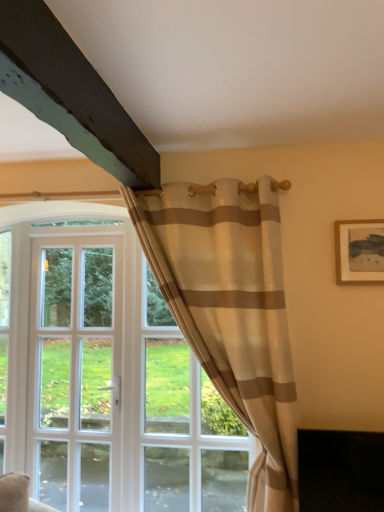
What is the approximate height of beige striped fabric at center?

The height of beige striped fabric at center is 5.71 feet.

You are a GUI agent. You are given a task and a screenshot of the screen. Output one action in this format:
    pyautogui.click(x=<x>, y=<y>)
    Task: Click on the beige striped fabric at center
    
    Given the screenshot: What is the action you would take?
    pyautogui.click(x=231, y=309)

At what (x,y) coordinates should I click in order to perform the action: click on beige striped fabric at center. Please return your answer as a coordinate pair (x, y). This screenshot has height=512, width=384. Looking at the image, I should click on (231, 309).

Is beige striped fabric at center in front of or behind wooden framed artwork at upper right in the image?

beige striped fabric at center is in front of wooden framed artwork at upper right.

Is beige striped fabric at center looking in the opposite direction of wooden framed artwork at upper right?

No, wooden framed artwork at upper right is not at the back of beige striped fabric at center.

Is beige striped fabric at center beside wooden framed artwork at upper right?

No, beige striped fabric at center is not in contact with wooden framed artwork at upper right.

Is wooden framed artwork at upper right located outside beige striped fabric at center?

Indeed, wooden framed artwork at upper right is completely outside beige striped fabric at center.

Looking at the image, does wooden framed artwork at upper right seem bigger or smaller compared to beige striped fabric at center?

Clearly, wooden framed artwork at upper right is smaller in size than beige striped fabric at center.

I want to click on picture frame above the beige striped fabric at center (from a real-world perspective), so click(359, 251).

Which is farther, (368, 234) or (214, 222)?

The point (368, 234) is more distant.

From a real-world perspective, is wooden framed artwork at upper right located beneath white glass door at left?

Actually, wooden framed artwork at upper right is physically above white glass door at left in the real world.

The width and height of the screenshot is (384, 512). I want to click on picture frame above the white glass door at left (from the image's perspective), so click(359, 251).

Is point (383, 252) positioned before point (50, 347)?

Yes, point (383, 252) is closer to viewer.

How distant is wooden framed artwork at upper right from white glass door at left?

wooden framed artwork at upper right is 2.83 meters from white glass door at left.

Is point (107, 251) in front of point (374, 222)?

No, it is behind (374, 222).

What's the angular difference between white glass door at left and wooden framed artwork at upper right's facing directions?

0.346 degrees.

Does white glass door at left have a lesser height compared to wooden framed artwork at upper right?

No.

Which of these two, white glass door at left or wooden framed artwork at upper right, is thinner?

Thinner between the two is wooden framed artwork at upper right.

Between beige striped fabric at center and white glass door at left, which one has larger size?

With larger size is beige striped fabric at center.

Is beige striped fabric at center to the right of white glass door at left from the viewer's perspective?

Correct, you'll find beige striped fabric at center to the right of white glass door at left.

Is there a large distance between beige striped fabric at center and white glass door at left?

beige striped fabric at center is far away from white glass door at left.

Considering the positions of objects beige striped fabric at center and white glass door at left in the image provided, who is behind, beige striped fabric at center or white glass door at left?

Positioned behind is white glass door at left.

How distant is white glass door at left from beige striped fabric at center?

white glass door at left is 2.22 meters from beige striped fabric at center.

Which is more to the left, white glass door at left or beige striped fabric at center?

white glass door at left is more to the left.

Which object is further away from the camera, white glass door at left or beige striped fabric at center?

white glass door at left is behind.

Is white glass door at left positioned with its back to beige striped fabric at center?

No.

Find the location of a particular element. This screenshot has width=384, height=512. picture frame that is above the beige striped fabric at center (from a real-world perspective) is located at coordinates (359, 251).

The width and height of the screenshot is (384, 512). What are the coordinates of `picture frame that appears on the right of beige striped fabric at center` in the screenshot? It's located at [359, 251].

When comparing their distances from beige striped fabric at center, does wooden framed artwork at upper right or white glass door at left seem further?

The object further to beige striped fabric at center is white glass door at left.

Estimate the real-world distances between objects in this image. Which object is closer to white glass door at left, beige striped fabric at center or wooden framed artwork at upper right?

beige striped fabric at center is closer to white glass door at left.

Based on their spatial positions, is white glass door at left or wooden framed artwork at upper right further from beige striped fabric at center?

white glass door at left is positioned further to the anchor beige striped fabric at center.

When comparing their distances from wooden framed artwork at upper right, does beige striped fabric at center or white glass door at left seem closer?

Among the two, beige striped fabric at center is located nearer to wooden framed artwork at upper right.

Considering their positions, is wooden framed artwork at upper right positioned further to white glass door at left than beige striped fabric at center?

wooden framed artwork at upper right is further to white glass door at left.

Which object lies further to the anchor point wooden framed artwork at upper right, white glass door at left or beige striped fabric at center?

white glass door at left.

The image size is (384, 512). I want to click on curtain between white glass door at left and wooden framed artwork at upper right, so click(231, 309).